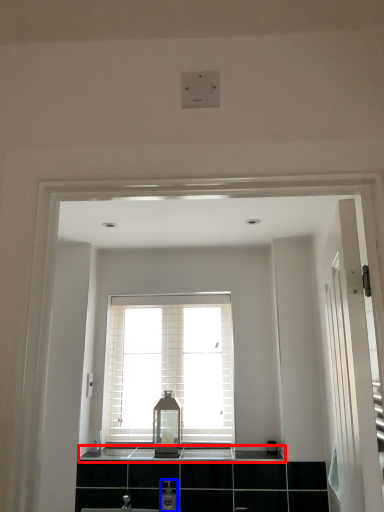
Question: Which of the following is the closest to the observer, counter top (highlighted by a red box) or toiletry (highlighted by a blue box)?

Choices:
 (A) counter top
 (B) toiletry

Answer: (B)